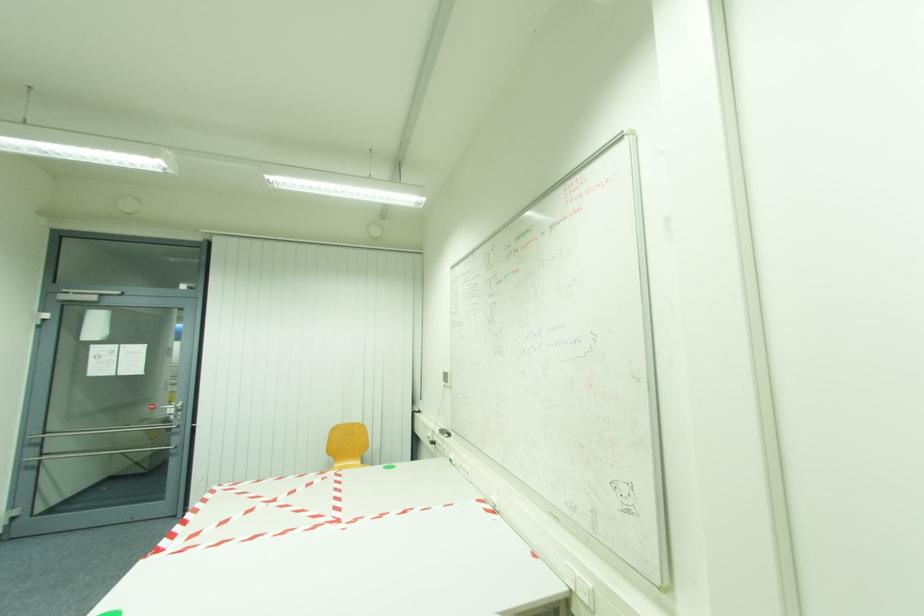
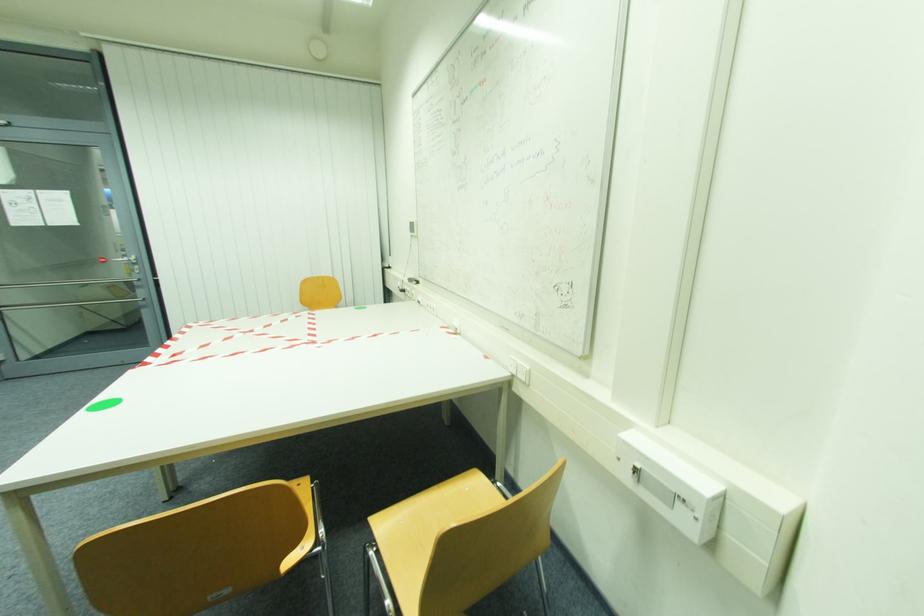
Question: The images are taken continuously from a first-person perspective. In which direction is your viewpoint rotating?

Choices:
 (A) Left
 (B) Right
 (C) Up
 (D) Down

Answer: (D)